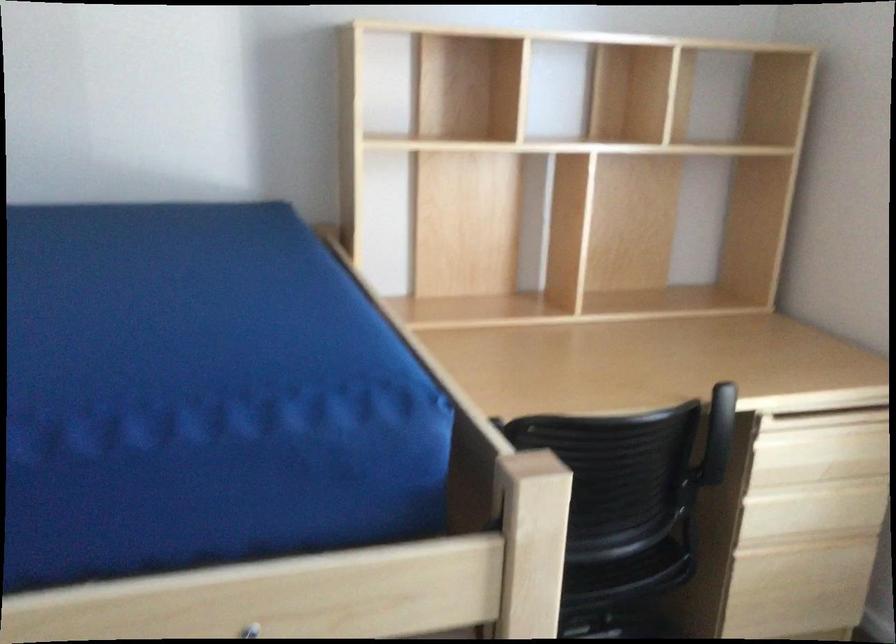
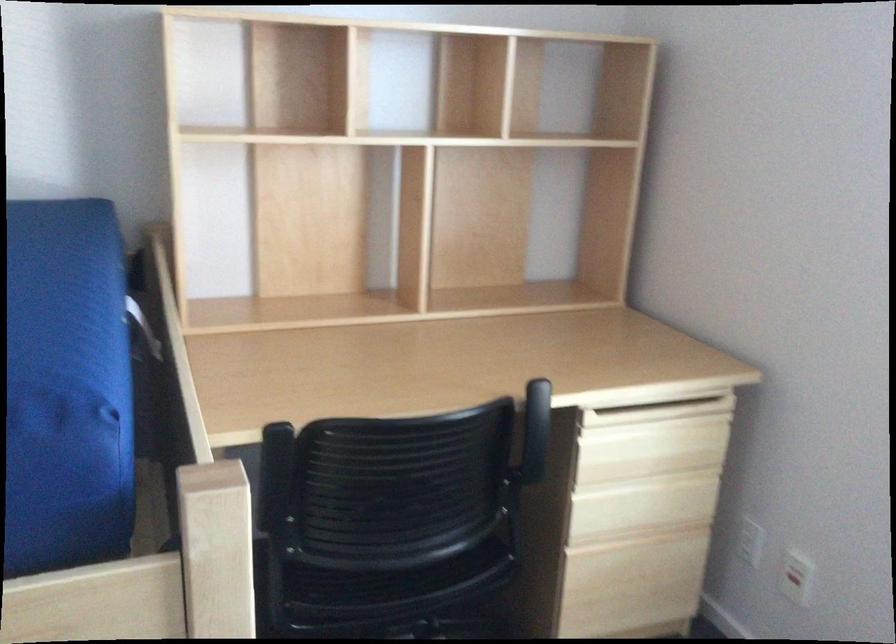
Locate, in the second image, the point that corresponds to point (811, 512) in the first image.

(642, 506)